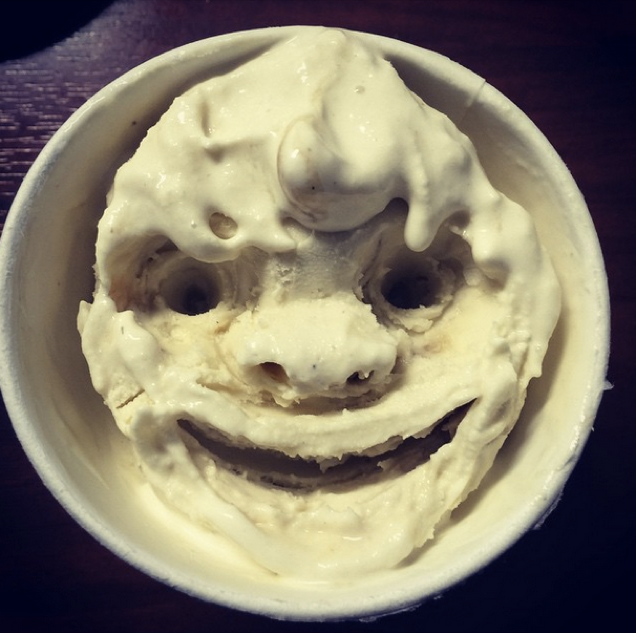
What are the coordinates of `table` in the screenshot? It's located at (39, 78).